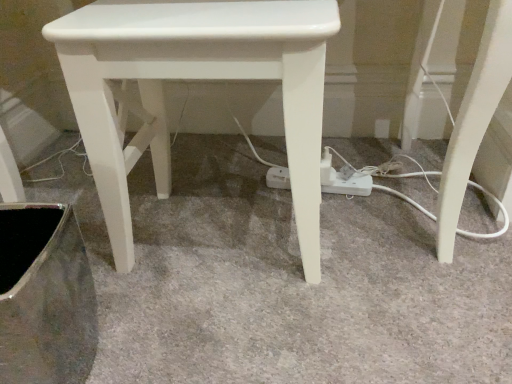
Question: Does white plastic extension cord at center have a lesser width compared to white glossy stool at center?

Choices:
 (A) yes
 (B) no

Answer: (A)

Question: Is white glossy stool at center a part of white plastic extension cord at center?

Choices:
 (A) no
 (B) yes

Answer: (A)

Question: Is white plastic extension cord at center to the right of white glossy stool at center from the viewer's perspective?

Choices:
 (A) yes
 (B) no

Answer: (A)

Question: Can you confirm if white plastic extension cord at center is smaller than white glossy stool at center?

Choices:
 (A) yes
 (B) no

Answer: (A)

Question: Does white plastic extension cord at center come in front of white glossy stool at center?

Choices:
 (A) no
 (B) yes

Answer: (A)

Question: Is there a large distance between white plastic extension cord at center and white glossy stool at center?

Choices:
 (A) yes
 (B) no

Answer: (B)

Question: From a real-world perspective, is metallic silver swivel chair at lower left located higher than white plastic extension cord at center?

Choices:
 (A) no
 (B) yes

Answer: (B)

Question: From the image's perspective, is metallic silver swivel chair at lower left on white plastic extension cord at center?

Choices:
 (A) yes
 (B) no

Answer: (B)

Question: Can you confirm if metallic silver swivel chair at lower left is positioned to the right of white plastic extension cord at center?

Choices:
 (A) yes
 (B) no

Answer: (B)

Question: Is metallic silver swivel chair at lower left taller than white plastic extension cord at center?

Choices:
 (A) yes
 (B) no

Answer: (A)

Question: From a real-world perspective, does metallic silver swivel chair at lower left sit lower than white plastic extension cord at center?

Choices:
 (A) no
 (B) yes

Answer: (A)

Question: Does metallic silver swivel chair at lower left turn towards white plastic extension cord at center?

Choices:
 (A) no
 (B) yes

Answer: (A)

Question: Would you say white glossy stool at center contains white plastic extension cord at center?

Choices:
 (A) yes
 (B) no

Answer: (B)